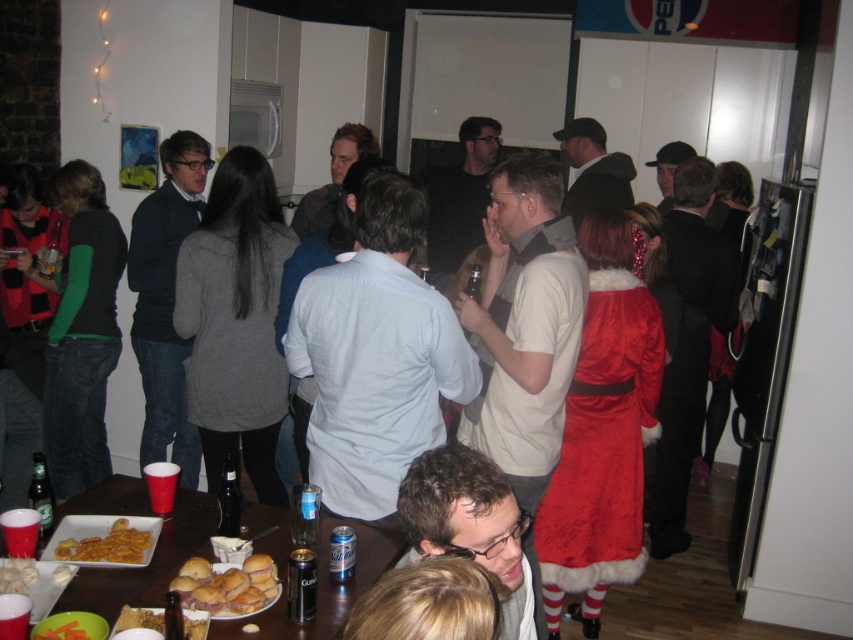
You are planning to place the golden brown bread at lower left on the wooden table at center. Based on their sizes, will the bread fit on the table?

The wooden table at center is wider than the golden brown bread at lower left, so the bread will fit on the table.

You are at a party and want to grab a snack. You see the golden brown bread at lower left and the clear glass beer at table center. Which item is closer to you?

The golden brown bread at lower left is closer to the viewer than the clear glass beer at table center.